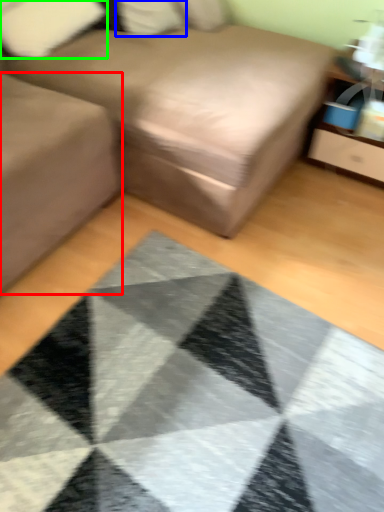
Question: Considering the real-world distances, which object is closest to gray (highlighted by a red box)? pillow (highlighted by a blue box) or pillow (highlighted by a green box).

Choices:
 (A) pillow
 (B) pillow

Answer: (B)